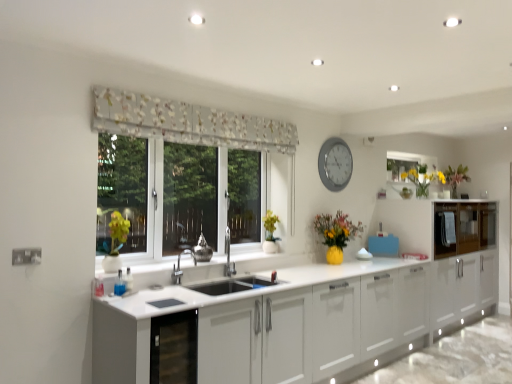
What do you see at coordinates (202, 250) in the screenshot?
I see `metallic silver vase at center` at bounding box center [202, 250].

Where is `green matte plant at left`? Image resolution: width=512 pixels, height=384 pixels. green matte plant at left is located at coordinates pyautogui.click(x=116, y=234).

Image resolution: width=512 pixels, height=384 pixels. What do you see at coordinates (335, 164) in the screenshot?
I see `silver metallic clock at upper center` at bounding box center [335, 164].

Find the location of a particular element. The image size is (512, 384). yellow glass vase at upper right is located at coordinates (423, 179).

Where is `metallic silver vase at center`? metallic silver vase at center is located at coordinates (202, 250).

How different are the orientations of yellow glass vase at upper right and silver metallic clock at upper center in degrees?

The facing directions of yellow glass vase at upper right and silver metallic clock at upper center are 0.252 degrees apart.

The height and width of the screenshot is (384, 512). What are the coordinates of `floral arrangement below the silver metallic clock at upper center (from the image's perspective)` in the screenshot? It's located at (423, 179).

From the image's perspective, would you say yellow glass vase at upper right is shown under silver metallic clock at upper center?

Yes.

Which object is wider, yellow glass vase at upper right or silver metallic clock at upper center?

yellow glass vase at upper right.

In the scene shown: Can green matte plant at left be found inside metallic silver vase at center?

No.

How much distance is there between metallic silver vase at center and green matte plant at left?

metallic silver vase at center and green matte plant at left are 23.96 inches apart.

Where is `appliance below the green matte plant at left (from the image's perspective)`? The width and height of the screenshot is (512, 384). appliance below the green matte plant at left (from the image's perspective) is located at coordinates (202, 250).

Which of these two, metallic silver vase at center or green matte plant at left, stands taller?

Standing taller between the two is green matte plant at left.

From the image's perspective, which is above, yellow glass vase at upper right or metallic silver vase at center?

yellow glass vase at upper right.

Is point (419, 184) farther from viewer compared to point (197, 248)?

Yes, point (419, 184) is behind point (197, 248).

From a real-world perspective, is yellow glass vase at upper right physically below metallic silver vase at center?

No, from a real-world perspective, yellow glass vase at upper right is not under metallic silver vase at center.

How many degrees apart are the facing directions of yellow glass vase at upper right and metallic silver vase at center?

0.00185 degrees.

Does green matte plant at left come behind floral fabric curtain at upper center?

Yes, it is.

Considering the sizes of objects green matte plant at left and floral fabric curtain at upper center in the image provided, who is taller, green matte plant at left or floral fabric curtain at upper center?

green matte plant at left is taller.

From the image's perspective, between green matte plant at left and floral fabric curtain at upper center, who is located below?

green matte plant at left is shown below in the image.

You are a GUI agent. You are given a task and a screenshot of the screen. Output one action in this format:
    pyautogui.click(x=<x>, y=<y>)
    Task: Click on the plant lying below the floral fabric curtain at upper center (from the image's perspective)
    This screenshot has width=512, height=384.
    Given the screenshot: What is the action you would take?
    pyautogui.click(x=116, y=234)

Between point (198, 244) and point (325, 146), which one is positioned behind?

Positioned behind is point (325, 146).

Could you tell me if metallic silver vase at center is facing silver metallic clock at upper center?

No.

Does metallic silver vase at center have a lesser width compared to silver metallic clock at upper center?

No.

From a real-world perspective, which is physically below, metallic silver vase at center or silver metallic clock at upper center?

From a 3D spatial view, metallic silver vase at center is below.

Does point (115, 239) appear closer or farther from the camera than point (341, 185)?

Point (115, 239) is positioned closer to the camera compared to point (341, 185).

In the scene shown: Is green matte plant at left to the right of silver metallic clock at upper center from the viewer's perspective?

No.

Looking at the image, does green matte plant at left seem bigger or smaller compared to silver metallic clock at upper center?

green matte plant at left is smaller than silver metallic clock at upper center.

The height and width of the screenshot is (384, 512). Find the location of `clock above the green matte plant at left (from the image's perspective)`. clock above the green matte plant at left (from the image's perspective) is located at coordinates (335, 164).

Does glossy wood cabinets at right have a larger size compared to silver metallic clock at upper center?

Yes.

From a real-world perspective, is glossy wood cabinets at right physically located above or below silver metallic clock at upper center?

In terms of real-world spatial position, glossy wood cabinets at right is below silver metallic clock at upper center.

Which object is thinner, glossy wood cabinets at right or silver metallic clock at upper center?

With smaller width is silver metallic clock at upper center.

You are a GUI agent. You are given a task and a screenshot of the screen. Output one action in this format:
    pyautogui.click(x=<x>, y=<y>)
    Task: Click on the clock on the left of yellow glass vase at upper right
    
    Given the screenshot: What is the action you would take?
    pyautogui.click(x=335, y=164)

The image size is (512, 384). Find the location of `plant that appears above the metallic silver vase at center (from a real-world perspective)`. plant that appears above the metallic silver vase at center (from a real-world perspective) is located at coordinates (116, 234).

Based on their spatial positions, is floral fabric curtain at upper center or metallic silver vase at center closer to glossy wood cabinets at right?

floral fabric curtain at upper center is closer to glossy wood cabinets at right.

From the image, which object appears to be nearer to floral fabric curtain at upper center, green matte plant at left or yellow glass vase at upper right?

green matte plant at left.

Looking at the image, which one is located further to metallic silver vase at center, yellow glass vase at upper right or green matte plant at left?

yellow glass vase at upper right is positioned further to the anchor metallic silver vase at center.

From the image, which object appears to be nearer to metallic silver vase at center, yellow glass vase at upper right or silver metallic clock at upper center?

silver metallic clock at upper center lies closer to metallic silver vase at center than the other object.

Based on their spatial positions, is metallic silver vase at center or floral fabric curtain at upper center closer to glossy wood cabinets at right?

floral fabric curtain at upper center.

When comparing their distances from green matte plant at left, does yellow glass vase at upper right or silver metallic clock at upper center seem further?

Among the two, yellow glass vase at upper right is located further to green matte plant at left.

Which object lies further to the anchor point floral fabric curtain at upper center, metallic silver vase at center or yellow glass vase at upper right?

yellow glass vase at upper right is positioned further to the anchor floral fabric curtain at upper center.

When comparing their distances from yellow glass vase at upper right, does silver metallic clock at upper center or green matte plant at left seem further?

The object further to yellow glass vase at upper right is green matte plant at left.

Locate an element on the screen. The image size is (512, 384). appliance located between green matte plant at left and silver metallic clock at upper center in the left-right direction is located at coordinates (202, 250).

The height and width of the screenshot is (384, 512). I want to click on clock between green matte plant at left and yellow glass vase at upper right from left to right, so click(x=335, y=164).

Where is `clock situated between floral fabric curtain at upper center and glossy wood cabinets at right from left to right`? The height and width of the screenshot is (384, 512). clock situated between floral fabric curtain at upper center and glossy wood cabinets at right from left to right is located at coordinates pyautogui.click(x=335, y=164).

I want to click on appliance between green matte plant at left and glossy wood cabinets at right in the horizontal direction, so click(x=202, y=250).